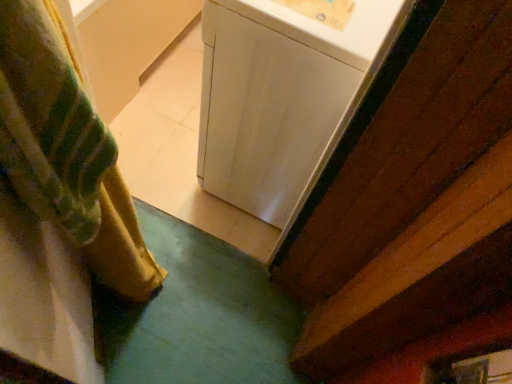
Describe the element at coordinates (66, 150) in the screenshot. I see `velvety green curtain at left` at that location.

Based on the photo, in order to face velvety green curtain at left, should I rotate leftwards or rightwards?

Turn left by 18.490 degrees to look at velvety green curtain at left.

You are a GUI agent. You are given a task and a screenshot of the screen. Output one action in this format:
    pyautogui.click(x=<x>, y=<y>)
    Task: Click on the velvety green curtain at left
    This screenshot has height=384, width=512.
    Given the screenshot: What is the action you would take?
    pyautogui.click(x=66, y=150)

In order to face white glossy washing machine at center, should I rotate leftwards or rightwards?

To face it directly, rotate right by 5.134 degrees.

Measure the distance between point (270, 41) and camera.

They are 35.67 inches apart.

Identify the location of white glossy washing machine at center. (278, 96).

Describe the element at coordinates (278, 96) in the screenshot. I see `white glossy washing machine at center` at that location.

Where is `velvety green curtain at left`? This screenshot has height=384, width=512. velvety green curtain at left is located at coordinates (66, 150).

Is velvety green curtain at left at the right side of white glossy washing machine at center?

Incorrect, velvety green curtain at left is not on the right side of white glossy washing machine at center.

Is the depth of velvety green curtain at left greater than that of white glossy washing machine at center?

No, it is in front of white glossy washing machine at center.

Does point (116, 228) come farther from viewer compared to point (199, 154)?

No.

From the picture: From the image's perspective, which is above, velvety green curtain at left or white glossy washing machine at center?

white glossy washing machine at center is shown above in the image.

Consider the image. From a real-world perspective, is velvety green curtain at left physically located above or below white glossy washing machine at center?

Clearly, from a real-world perspective, velvety green curtain at left is above white glossy washing machine at center.

Can you confirm if velvety green curtain at left is thinner than white glossy washing machine at center?

Indeed, velvety green curtain at left has a lesser width compared to white glossy washing machine at center.

Between velvety green curtain at left and white glossy washing machine at center, which one has more height?

With more height is velvety green curtain at left.

Can you confirm if velvety green curtain at left is bigger than white glossy washing machine at center?

Incorrect, velvety green curtain at left is not larger than white glossy washing machine at center.

Is white glossy washing machine at center surrounded by velvety green curtain at left?

Actually, white glossy washing machine at center is outside velvety green curtain at left.

Is velvety green curtain at left directly adjacent to white glossy washing machine at center?

velvety green curtain at left and white glossy washing machine at center are clearly separated.

Is velvety green curtain at left turned away from white glossy washing machine at center?

No, white glossy washing machine at center is not at the back of velvety green curtain at left.

What's the angular difference between velvety green curtain at left and white glossy washing machine at center's facing directions?

The facing directions of velvety green curtain at left and white glossy washing machine at center are 139 degrees apart.

The height and width of the screenshot is (384, 512). I want to click on curtain above the white glossy washing machine at center (from a real-world perspective), so click(66, 150).

Based on their positions, is white glossy washing machine at center located to the left or right of velvety green curtain at left?

white glossy washing machine at center is to the right of velvety green curtain at left.

Which is in front, white glossy washing machine at center or velvety green curtain at left?

velvety green curtain at left is closer to the camera.

Which point is more distant from viewer, (251,57) or (71,86)?

Positioned behind is point (251,57).

From the image's perspective, is white glossy washing machine at center on velvety green curtain at left?

Correct, white glossy washing machine at center appears higher than velvety green curtain at left in the image.

From a real-world perspective, which object stands above the other?

In real-world perspective, velvety green curtain at left is above.

Is white glossy washing machine at center wider or thinner than velvety green curtain at left?

Clearly, white glossy washing machine at center has more width compared to velvety green curtain at left.

Between white glossy washing machine at center and velvety green curtain at left, which one has less height?

With less height is white glossy washing machine at center.

Can you confirm if white glossy washing machine at center is smaller than velvety green curtain at left?

No, white glossy washing machine at center is not smaller than velvety green curtain at left.

Which is correct: white glossy washing machine at center is inside velvety green curtain at left, or outside of it?

white glossy washing machine at center is spatially situated outside velvety green curtain at left.

Is white glossy washing machine at center directly adjacent to velvety green curtain at left?

white glossy washing machine at center and velvety green curtain at left are not in contact.

Is white glossy washing machine at center facing away from velvety green curtain at left?

No, white glossy washing machine at center is not facing the opposite direction of velvety green curtain at left.

How many degrees apart are the facing directions of white glossy washing machine at center and velvety green curtain at left?

139 degrees.

At what (x,y) coordinates should I click in order to perform the action: click on washing machine below the velvety green curtain at left (from a real-world perspective). Please return your answer as a coordinate pair (x, y). This screenshot has width=512, height=384. Looking at the image, I should click on (278, 96).

The width and height of the screenshot is (512, 384). I want to click on curtain located above the white glossy washing machine at center (from a real-world perspective), so click(x=66, y=150).

Where is `washing machine lying on the right of velvety green curtain at left`? washing machine lying on the right of velvety green curtain at left is located at coordinates (278, 96).